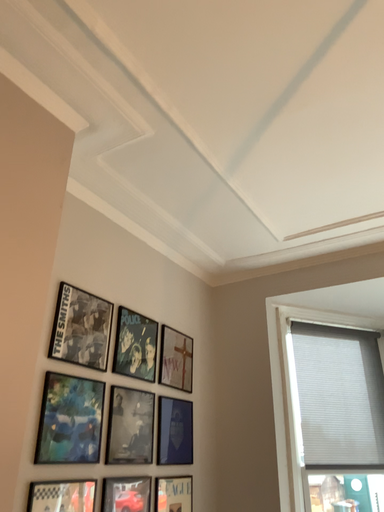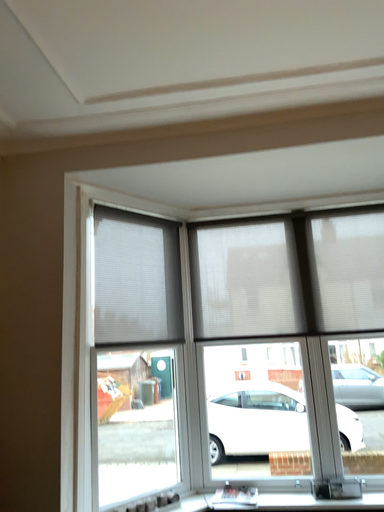
Question: How did the camera likely rotate when shooting the video?

Choices:
 (A) rotated upward
 (B) rotated downward

Answer: (B)